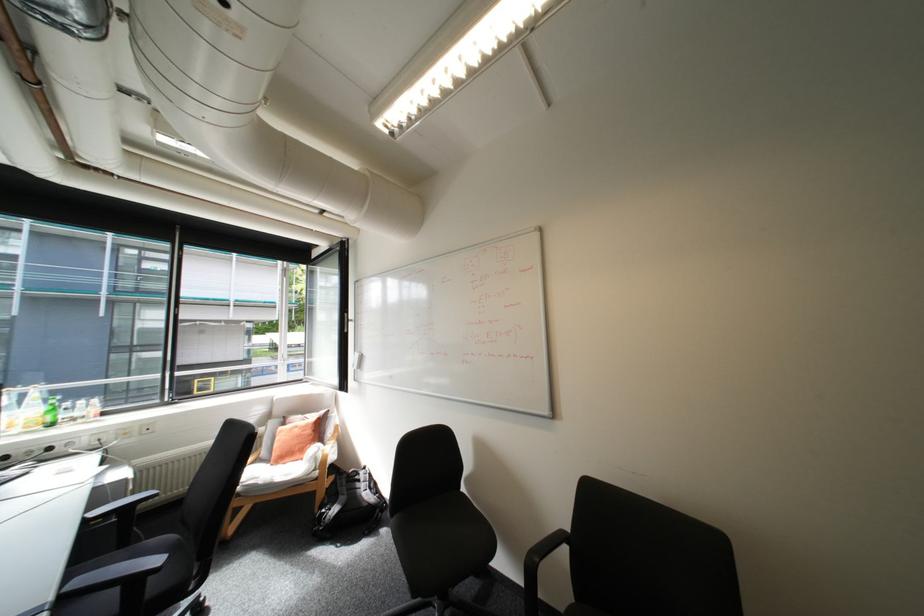
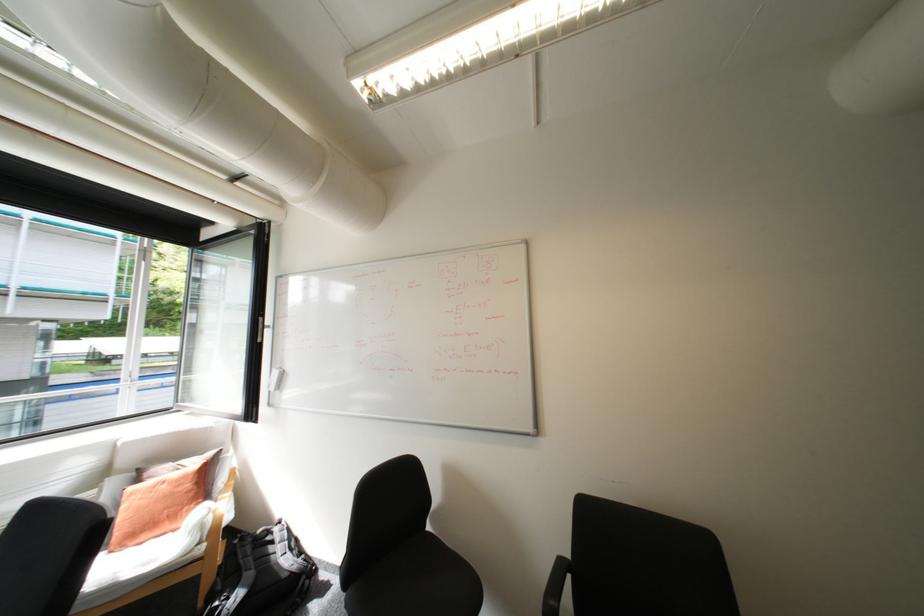
The point at (307, 429) is marked in the first image. Where is the corresponding point in the second image?

(175, 485)